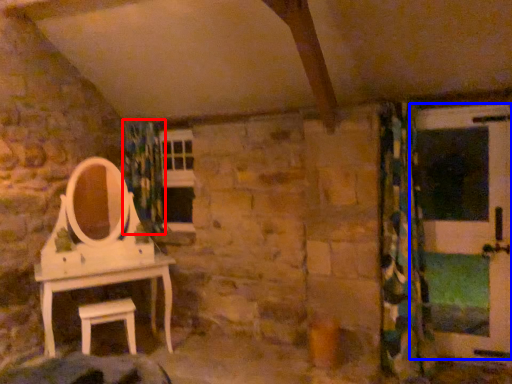
Question: Which object is further to the camera taking this photo, shower curtain (highlighted by a red box) or screen door (highlighted by a blue box)?

Choices:
 (A) shower curtain
 (B) screen door

Answer: (A)